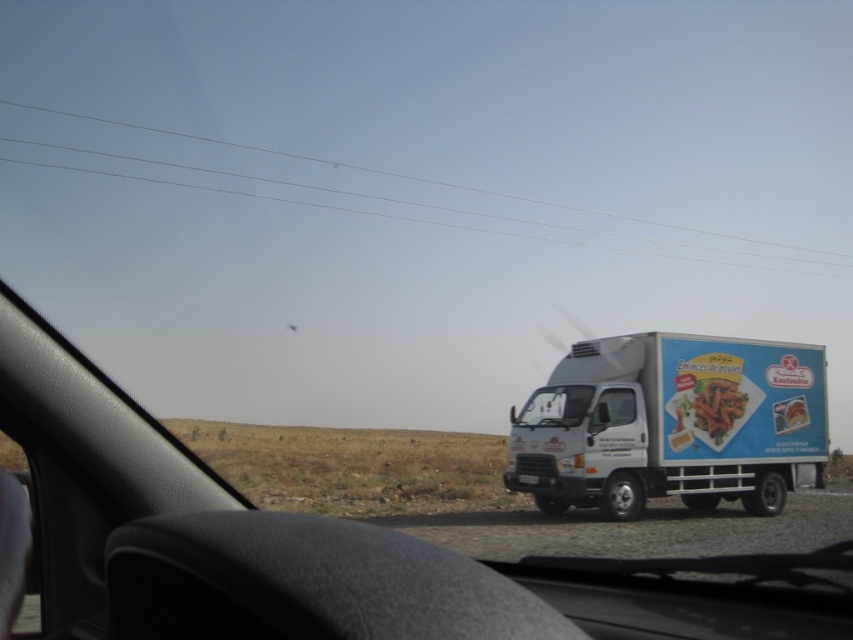
Between smooth plastic carrots at center and transparent glass windshield at center, which one has less height?

With less height is transparent glass windshield at center.

Between point (701, 388) and point (538, 404), which one is positioned in front?

Point (701, 388)

You are a GUI agent. You are given a task and a screenshot of the screen. Output one action in this format:
    pyautogui.click(x=<x>, y=<y>)
    Task: Click on the smooth plastic carrots at center
    Image resolution: width=853 pixels, height=640 pixels.
    Given the screenshot: What is the action you would take?
    pyautogui.click(x=712, y=406)

Which of these two, white matte trailer truck at right or clear wire at upper center, stands taller?

With more height is clear wire at upper center.

Does white matte trailer truck at right appear on the right side of clear wire at upper center?

Yes, white matte trailer truck at right is to the right of clear wire at upper center.

Between point (677, 458) and point (241, 145), which one is positioned in front?

Positioned in front is point (677, 458).

Locate an element on the screen. The image size is (853, 640). white matte trailer truck at right is located at coordinates (669, 424).

Which is in front, point (584, 433) or point (532, 392)?

Positioned in front is point (584, 433).

Can you confirm if white matte trailer truck at right is taller than transparent glass windshield at center?

Indeed, white matte trailer truck at right has a greater height compared to transparent glass windshield at center.

Does point (753, 477) lie behind point (541, 419)?

Yes, point (753, 477) is farther from viewer.

The image size is (853, 640). In order to click on white matte trailer truck at right in this screenshot , I will do `click(669, 424)`.